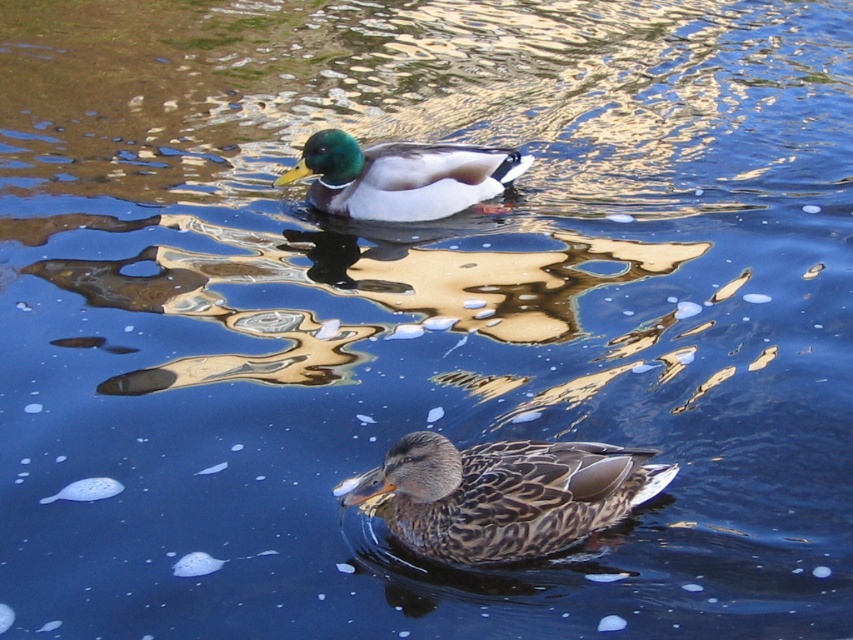
Does brown speckled feathers at center have a lesser width compared to shiny brown duck at upper center?

Correct, brown speckled feathers at center's width is less than shiny brown duck at upper center's.

Is point (485, 512) farther from camera compared to point (479, 177)?

No.

At what (x,y) coordinates should I click in order to perform the action: click on brown speckled feathers at center. Please return your answer as a coordinate pair (x, y). Looking at the image, I should click on (503, 493).